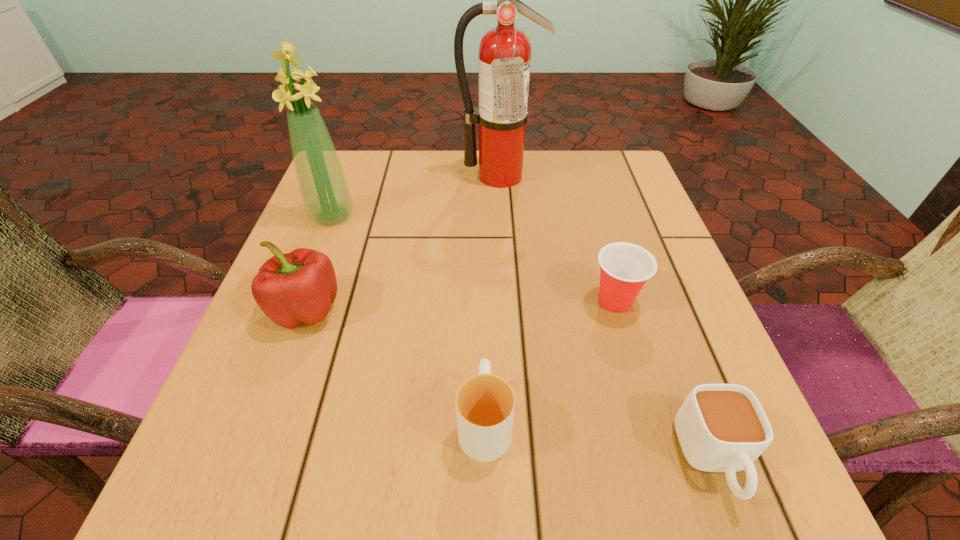
Locate an element on the screen. This screenshot has width=960, height=540. vacant position at the far edge of the desktop is located at coordinates (535, 192).

Locate an element on the screen. This screenshot has height=540, width=960. vacant space at the near edge is located at coordinates (339, 470).

The image size is (960, 540). In the image, there is a desktop. Find the location of `blank space at the left edge`. blank space at the left edge is located at coordinates (295, 436).

Where is `blank space at the right edge of the desktop`? This screenshot has height=540, width=960. blank space at the right edge of the desktop is located at coordinates (610, 213).

At what (x,y) coordinates should I click in order to perform the action: click on free point at the far right corner. Please return your answer as a coordinate pair (x, y). This screenshot has width=960, height=540. Looking at the image, I should click on (584, 154).

The image size is (960, 540). I want to click on vacant space that is in between the farthest cup and the bell pepper, so click(461, 305).

The width and height of the screenshot is (960, 540). Find the location of `blank region between the farthest object and the second farthest object`. blank region between the farthest object and the second farthest object is located at coordinates (416, 196).

Find the location of a particular element. The image size is (960, 540). free spot between the farthest cup and the farthest object is located at coordinates (557, 239).

Where is `free space between the farthest cup and the fifth shortest object`? Image resolution: width=960 pixels, height=540 pixels. free space between the farthest cup and the fifth shortest object is located at coordinates (473, 259).

Where is `unoccupied position between the bell pepper and the leftmost cup`? The height and width of the screenshot is (540, 960). unoccupied position between the bell pepper and the leftmost cup is located at coordinates (396, 366).